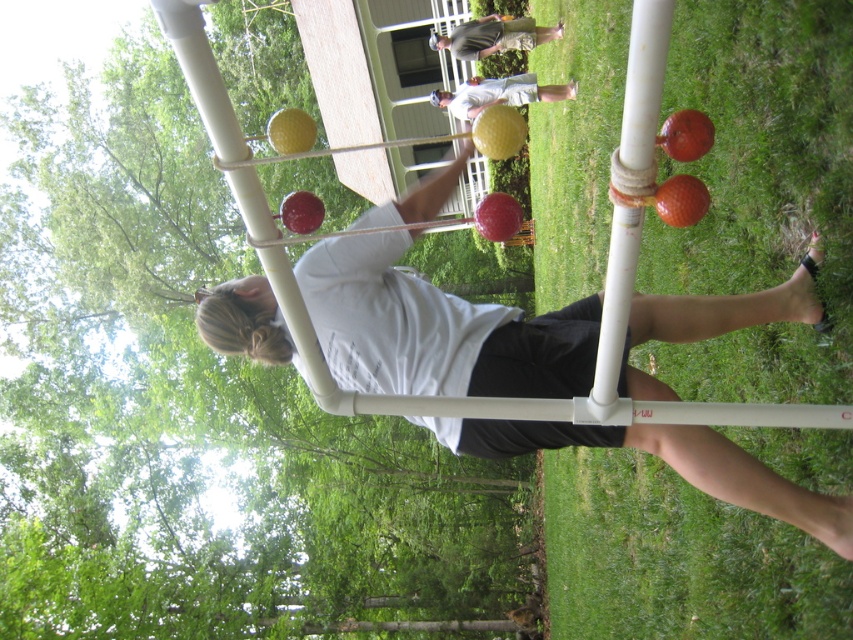
The height and width of the screenshot is (640, 853). What do you see at coordinates (492, 36) in the screenshot?
I see `light gray shirt at upper center` at bounding box center [492, 36].

Who is positioned more to the right, light gray shirt at upper center or matte white shirt at center?

matte white shirt at center is more to the right.

Locate an element on the screen. light gray shirt at upper center is located at coordinates (492, 36).

Between white matte shirt at center and matte white shirt at center, which one is positioned higher?

matte white shirt at center is higher up.

Is white matte shirt at center bigger than matte white shirt at center?

Incorrect, white matte shirt at center is not larger than matte white shirt at center.

This screenshot has width=853, height=640. Find the location of `white matte shirt at center`. white matte shirt at center is located at coordinates (434, 330).

Can you confirm if white matte shirt at center is positioned below light gray shirt at upper center?

Indeed, white matte shirt at center is positioned under light gray shirt at upper center.

Does point (323, 324) lie in front of point (515, 24)?

Yes, it is in front of point (515, 24).

Who is more distant from viewer, [230,320] or [502,36]?

The point [502,36] is behind.

Find the location of `white matte shirt at center`. white matte shirt at center is located at coordinates (434, 330).